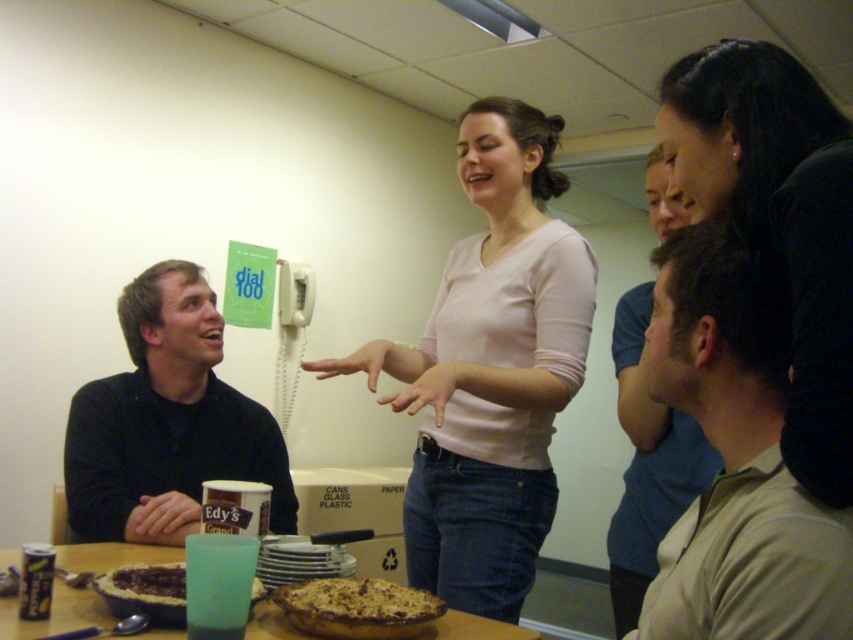
Question: Estimate the real-world distances between objects in this image. Which object is closer to the chocolate glazed pie at table center?

Choices:
 (A) wooden table at center
 (B) pink matte shirt at center
 (C) golden crumbly pie at center

Answer: (A)

Question: Which point is farther to the camera?

Choices:
 (A) chocolate glazed pie at table center
 (B) pink matte shirt at center

Answer: (B)

Question: Does beige cotton shirt at center appear on the left side of wooden table at center?

Choices:
 (A) yes
 (B) no

Answer: (B)

Question: Is dark brown hair at upper right positioned before black sweater at left?

Choices:
 (A) yes
 (B) no

Answer: (A)

Question: Observing the image, what is the correct spatial positioning of pink matte shirt at center in reference to wooden table at center?

Choices:
 (A) below
 (B) above

Answer: (B)

Question: Among these points, which one is nearest to the camera?

Choices:
 (A) (387, 600)
 (B) (245, 634)
 (C) (773, 236)

Answer: (C)